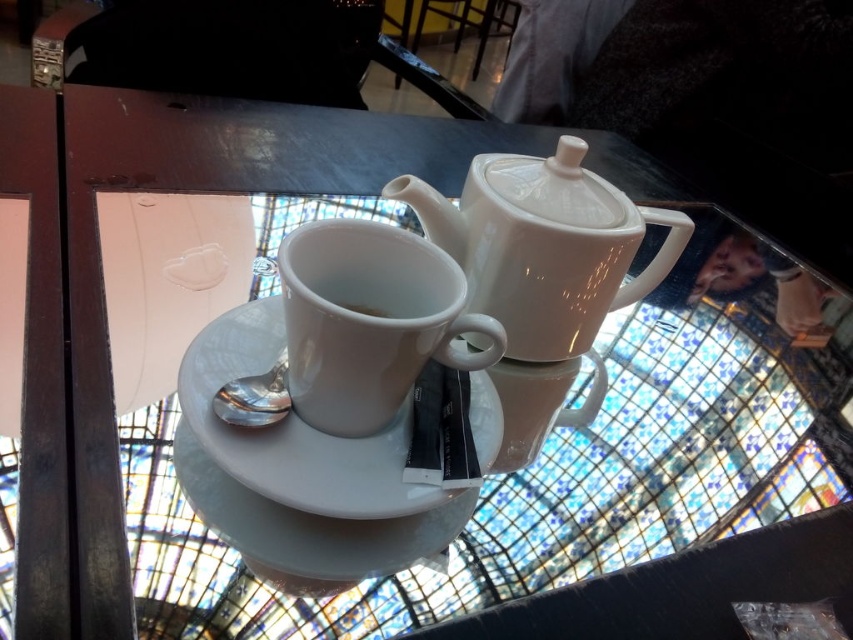
Which is below, white glossy teapot at upper center or white glossy mug at center?

Positioned lower is white glossy mug at center.

Who is more distant from viewer, (451, 244) or (321, 419)?

The point (451, 244) is more distant.

Is point (596, 220) behind point (289, 289)?

Yes, it is behind point (289, 289).

Identify the location of white glossy teapot at upper center. (543, 244).

Which is in front, point (370, 234) or point (424, 500)?

Point (424, 500) is more forward.

Can you confirm if white glossy mug at center is positioned above white ceramic saucer at center?

Indeed, white glossy mug at center is positioned over white ceramic saucer at center.

Measure the distance between point (370, 336) and camera.

Point (370, 336) and camera are 18.29 inches apart from each other.

This screenshot has height=640, width=853. What are the coordinates of `white glossy mug at center` in the screenshot? It's located at (369, 321).

Between white glossy teapot at upper center and white ceramic saucer at center, which one is positioned lower?

white ceramic saucer at center is below.

Is white glossy teapot at upper center smaller than white ceramic saucer at center?

Actually, white glossy teapot at upper center might be larger than white ceramic saucer at center.

The height and width of the screenshot is (640, 853). Describe the element at coordinates (543, 244) in the screenshot. I see `white glossy teapot at upper center` at that location.

This screenshot has height=640, width=853. In order to click on white glossy teapot at upper center in this screenshot , I will do `click(543, 244)`.